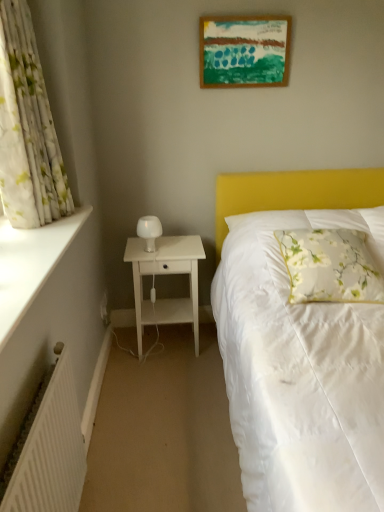
Where is `vacant space in front of white matte nightstand at left`? This screenshot has width=384, height=512. vacant space in front of white matte nightstand at left is located at coordinates (166, 389).